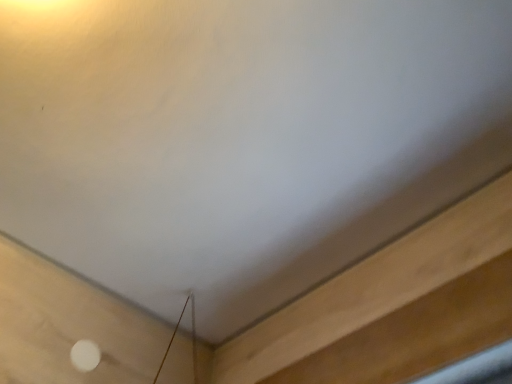
Question: Can you confirm if white matte dot at lower left is smaller than light brown wood at lower right?

Choices:
 (A) yes
 (B) no

Answer: (A)

Question: Does white matte dot at lower left lie in front of light brown wood at lower right?

Choices:
 (A) no
 (B) yes

Answer: (A)

Question: Is white matte dot at lower left taller than light brown wood at lower right?

Choices:
 (A) yes
 (B) no

Answer: (B)

Question: From the image's perspective, does white matte dot at lower left appear lower than light brown wood at lower right?

Choices:
 (A) no
 (B) yes

Answer: (B)

Question: Is white matte dot at lower left not inside light brown wood at lower right?

Choices:
 (A) no
 (B) yes

Answer: (B)

Question: Is white matte dot at lower left bigger than light brown wood at lower right?

Choices:
 (A) yes
 (B) no

Answer: (B)

Question: Does light brown wood at lower right have a greater height compared to white matte dot at lower left?

Choices:
 (A) yes
 (B) no

Answer: (A)

Question: Is white matte dot at lower left a part of light brown wood at lower right?

Choices:
 (A) no
 (B) yes

Answer: (A)

Question: From a real-world perspective, does light brown wood at lower right sit lower than white matte dot at lower left?

Choices:
 (A) yes
 (B) no

Answer: (A)

Question: From the image's perspective, does light brown wood at lower right appear lower than white matte dot at lower left?

Choices:
 (A) yes
 (B) no

Answer: (B)

Question: Can you confirm if light brown wood at lower right is positioned to the right of white matte dot at lower left?

Choices:
 (A) yes
 (B) no

Answer: (A)

Question: Considering the relative sizes of light brown wood at lower right and white matte dot at lower left in the image provided, is light brown wood at lower right wider than white matte dot at lower left?

Choices:
 (A) yes
 (B) no

Answer: (A)

Question: In terms of height, does light brown wood at lower right look taller or shorter compared to white matte dot at lower left?

Choices:
 (A) tall
 (B) short

Answer: (A)